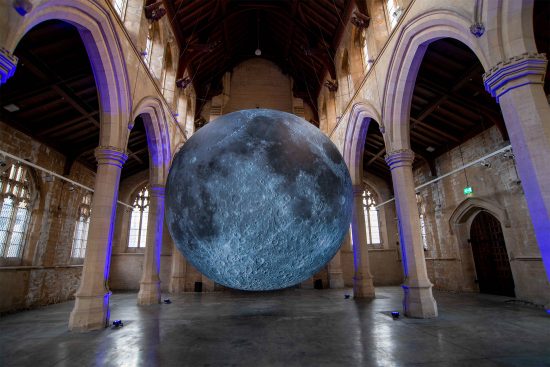
Locate an element on the screen. ceiling is located at coordinates (254, 88).